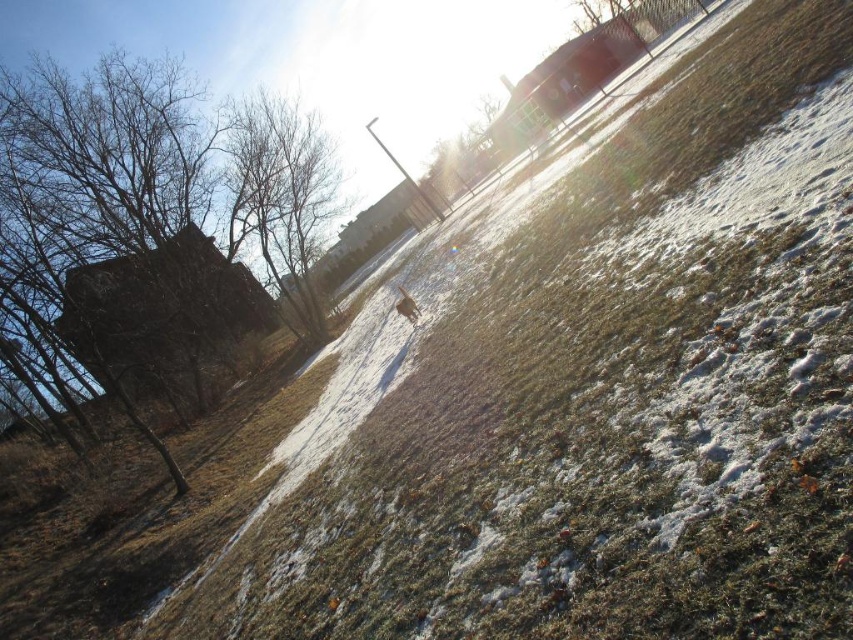
You are standing at the center of the scene and want to take a photo of the brown leafless tree at upper left. Which direction should you face to ensure the tree is in the frame?

The brown leafless tree at upper left is located at point (283,195), so you should face towards the upper left direction to capture it in your photo.

You are standing in the autumn scene and see the brown leafless tree at left and the brown fur at center. Which object is located to the right of the other?

The brown leafless tree at left is positioned on the left side of brown fur at center, so the brown fur at center is to the right of the brown leafless tree at left.